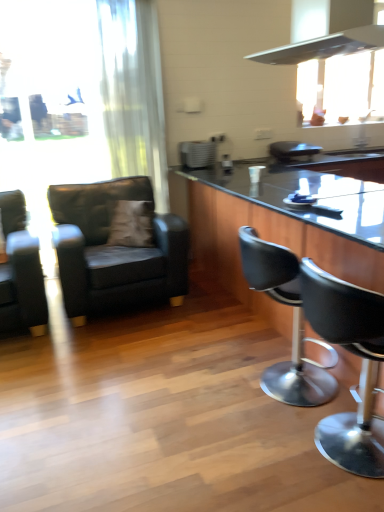
Locate an element on the screen. The width and height of the screenshot is (384, 512). vacant area situated below black leather bar stool at center, positioned as the 2th chair in right-to-left order (from a real-world perspective) is located at coordinates (266, 392).